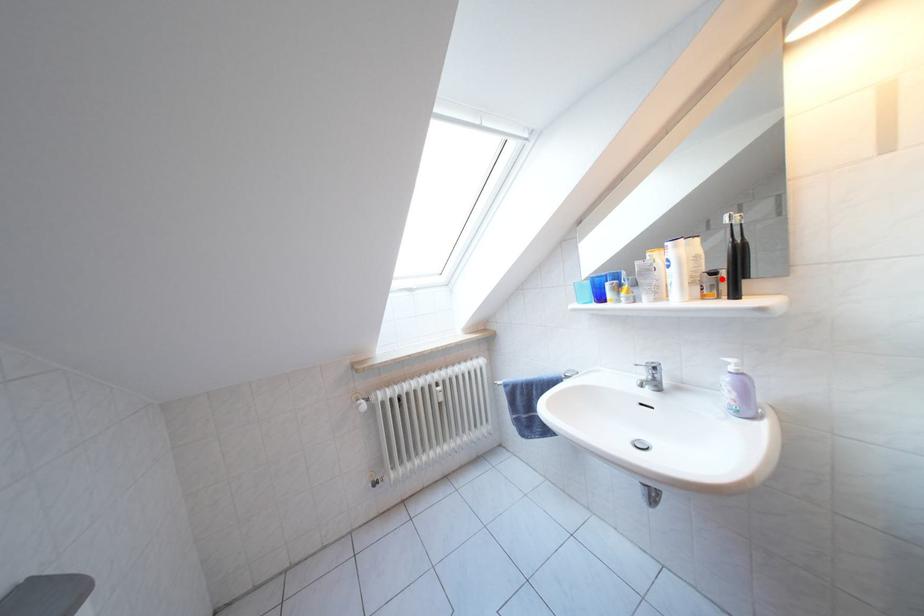
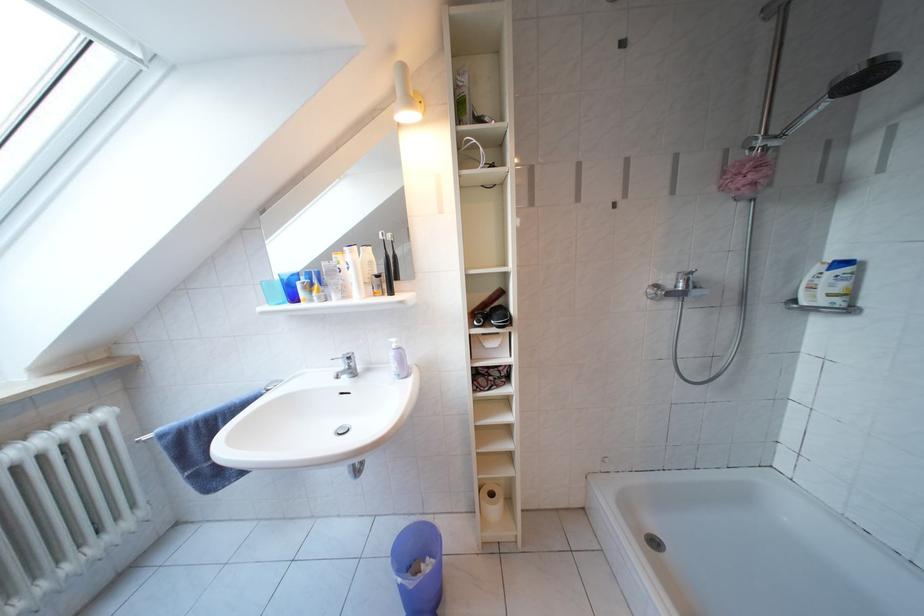
In the second image, find the point that corresponds to the highlighted location in the first image.

(386, 281)